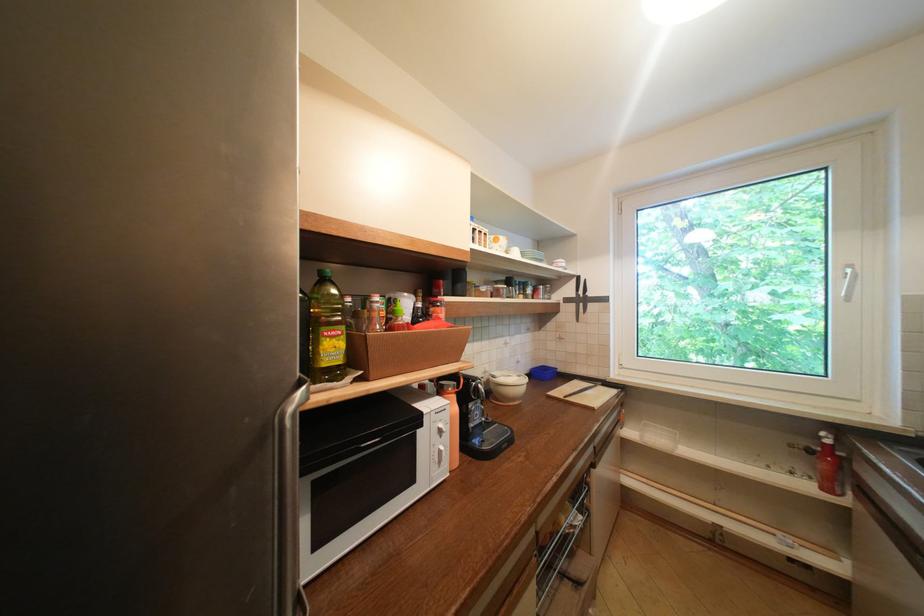
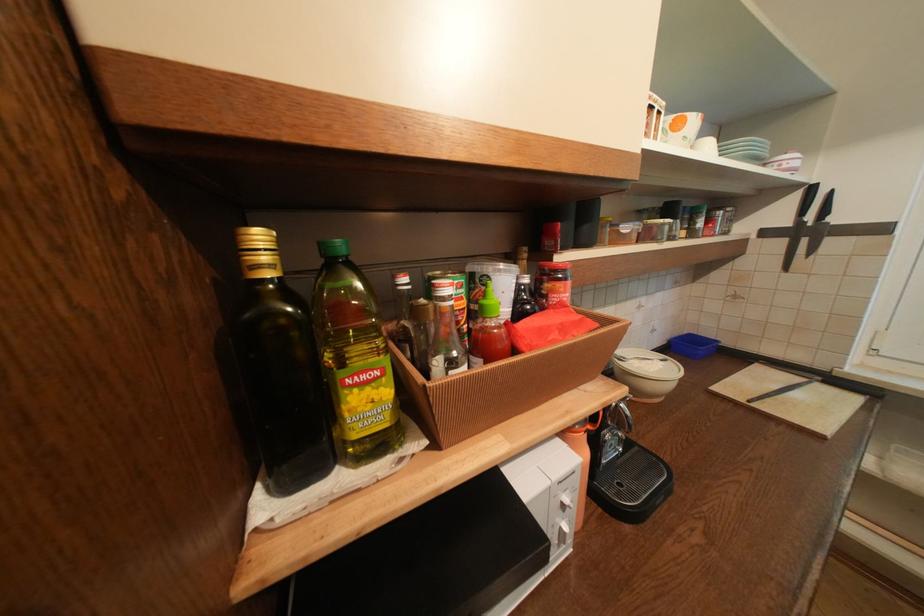
The point at (448, 432) is marked in the first image. Where is the corresponding point in the second image?

(573, 507)